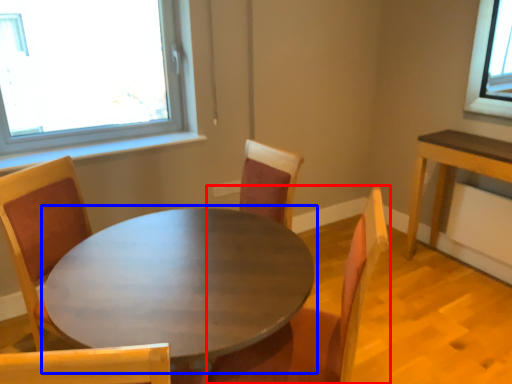
Question: Among these objects, which one is farthest to the camera, chair (highlighted by a red box) or coffee table (highlighted by a blue box)?

Choices:
 (A) chair
 (B) coffee table

Answer: (A)